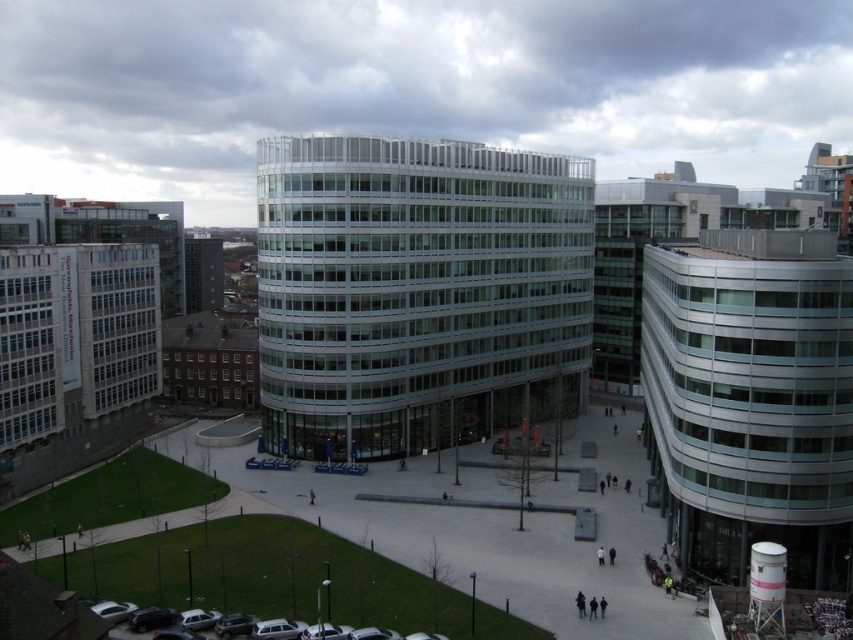
Question: Is glassy metallic building at center below matte black car at lower left?

Choices:
 (A) yes
 (B) no

Answer: (B)

Question: Considering the relative positions of glassy metallic building at center and matte black car at lower left in the image provided, where is glassy metallic building at center located with respect to matte black car at lower left?

Choices:
 (A) below
 (B) above

Answer: (B)

Question: Is glassy metallic building at center smaller than matte black car at lower left?

Choices:
 (A) yes
 (B) no

Answer: (B)

Question: Which of the following is the closest to the observer?

Choices:
 (A) coord(126,628)
 (B) coord(352,195)

Answer: (A)